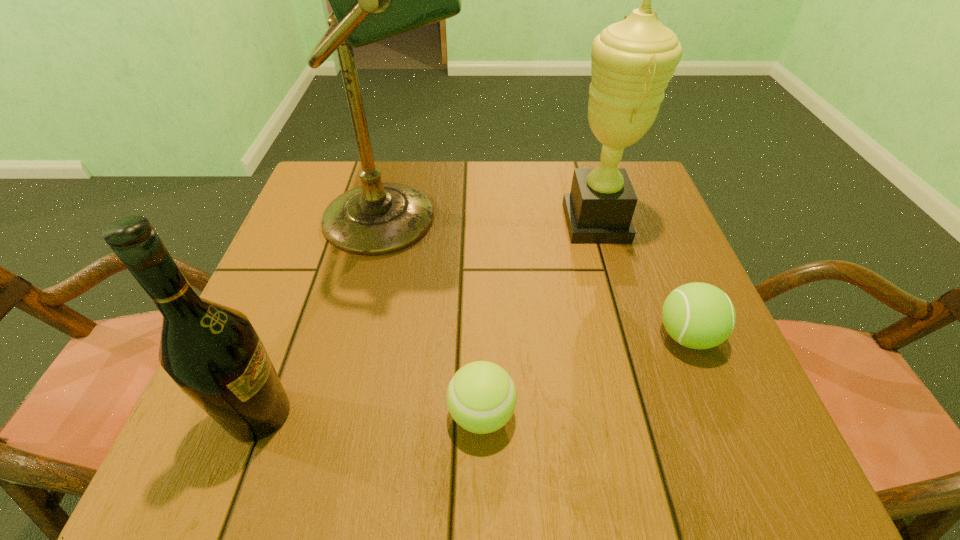
Where is `vacant space located 0.110m on the label of the third tallest object`? vacant space located 0.110m on the label of the third tallest object is located at coordinates (365, 415).

Identify the location of free region located 0.080m on the left of the farther tennis ball. The image size is (960, 540). (611, 336).

This screenshot has height=540, width=960. In order to click on vacant space located on the back of the left tennis ball in this screenshot , I will do `click(481, 259)`.

Find the location of a particular element. The width and height of the screenshot is (960, 540). table lamp that is at the far edge is located at coordinates (372, 0).

The width and height of the screenshot is (960, 540). In order to click on trophy cup that is at the far edge in this screenshot , I will do `click(633, 60)`.

You are a GUI agent. You are given a task and a screenshot of the screen. Output one action in this format:
    pyautogui.click(x=<x>, y=<y>)
    Task: Click on the wine bottle situated at the near edge
    This screenshot has height=540, width=960.
    Given the screenshot: What is the action you would take?
    pyautogui.click(x=212, y=352)

Where is `tennis ball present at the near edge`? The image size is (960, 540). tennis ball present at the near edge is located at coordinates (481, 397).

At what (x,y) coordinates should I click in order to perform the action: click on table lamp that is at the left edge. Please return your answer as a coordinate pair (x, y). Looking at the image, I should click on (372, 0).

Locate an element on the screen. Image resolution: width=960 pixels, height=540 pixels. wine bottle that is at the left edge is located at coordinates (212, 352).

I want to click on trophy cup that is at the right edge, so [x=633, y=60].